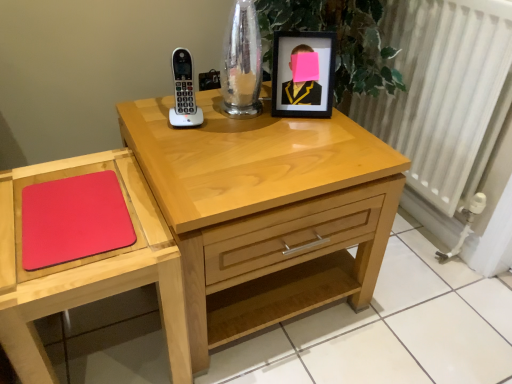
Locate an element on the screen. This screenshot has width=512, height=384. rubberized red mousepad at lower left is located at coordinates [73, 220].

What is the approximate height of rubberized red mousepad at lower left?

rubberized red mousepad at lower left is 2.75 centimeters tall.

Describe the element at coordinates (303, 74) in the screenshot. The width and height of the screenshot is (512, 384). I see `black matte picture frame at upper right` at that location.

You are a GUI agent. You are given a task and a screenshot of the screen. Output one action in this format:
    pyautogui.click(x=<x>, y=<y>)
    Task: Click on the white plastic phone at upper center
    
    Given the screenshot: What is the action you would take?
    pyautogui.click(x=184, y=92)

This screenshot has height=384, width=512. What do you see at coordinates (266, 212) in the screenshot?
I see `light wood nightstand at center` at bounding box center [266, 212].

At what (x,y) coordinates should I click in order to perform the action: click on rubberized red mousepad at lower left. Please return your answer as a coordinate pair (x, y). This screenshot has height=384, width=512. Looking at the image, I should click on (73, 220).

How different are the orientations of white textured radiator at right and white plastic phone at upper center in degrees?

The facing directions of white textured radiator at right and white plastic phone at upper center are 79.3 degrees apart.

From the image's perspective, is white textured radiator at right positioned above or below white plastic phone at upper center?

white textured radiator at right is above white plastic phone at upper center.

Between point (411, 98) and point (184, 115), which one is positioned in front?

Positioned in front is point (184, 115).

This screenshot has width=512, height=384. I want to click on phone on the left of white textured radiator at right, so 184,92.

Is light wood nightstand at center shorter than white plastic phone at upper center?

In fact, light wood nightstand at center may be taller than white plastic phone at upper center.

Is light wood nightstand at center not close to white plastic phone at upper center?

No.

In the scene shown: Is light wood nightstand at center looking in the opposite direction of white plastic phone at upper center?

No.

From the picture: Which is nearer, (395, 159) or (178, 78)?

Point (395, 159) is positioned closer to the camera compared to point (178, 78).

Looking at this image, is rubberized red mousepad at lower left oriented towards light wood nightstand at center?

No, rubberized red mousepad at lower left does not turn towards light wood nightstand at center.

Consider the image. Which of these two, rubberized red mousepad at lower left or light wood nightstand at center, stands shorter?

rubberized red mousepad at lower left.

Is rubberized red mousepad at lower left situated inside light wood nightstand at center or outside?

rubberized red mousepad at lower left is not enclosed by light wood nightstand at center.

From the image's perspective, is rubberized red mousepad at lower left located above light wood nightstand at center?

Yes, from the image's perspective, rubberized red mousepad at lower left is above light wood nightstand at center.

Based on the photo, does black matte picture frame at upper right have a lesser height compared to matte wooden mouse pad at lower left?

Indeed, black matte picture frame at upper right has a lesser height compared to matte wooden mouse pad at lower left.

From the image's perspective, is black matte picture frame at upper right located beneath matte wooden mouse pad at lower left?

No, from the image's perspective, black matte picture frame at upper right is not beneath matte wooden mouse pad at lower left.

Does black matte picture frame at upper right have a lesser width compared to matte wooden mouse pad at lower left?

Yes, black matte picture frame at upper right is thinner than matte wooden mouse pad at lower left.

Could you tell me if black matte picture frame at upper right is facing matte wooden mouse pad at lower left?

No, black matte picture frame at upper right is not turned towards matte wooden mouse pad at lower left.

Is point (326, 58) farther from viewer compared to point (61, 213)?

Yes, point (326, 58) is behind point (61, 213).

Between black matte picture frame at upper right and rubberized red mousepad at lower left, which one has smaller width?

Thinner between the two is black matte picture frame at upper right.

Is black matte picture frame at upper right looking in the opposite direction of rubberized red mousepad at lower left?

black matte picture frame at upper right is not turned away from rubberized red mousepad at lower left.

The height and width of the screenshot is (384, 512). I want to click on notepad to the left of black matte picture frame at upper right, so click(73, 220).

Considering the sizes of light wood nightstand at center and black matte picture frame at upper right in the image, is light wood nightstand at center wider or thinner than black matte picture frame at upper right?

In the image, light wood nightstand at center appears to be wider than black matte picture frame at upper right.

From a real-world perspective, is light wood nightstand at center positioned above or below black matte picture frame at upper right?

In terms of real-world spatial position, light wood nightstand at center is below black matte picture frame at upper right.

Considering the relative sizes of light wood nightstand at center and black matte picture frame at upper right in the image provided, is light wood nightstand at center shorter than black matte picture frame at upper right?

Incorrect, the height of light wood nightstand at center does not fall short of that of black matte picture frame at upper right.

Looking at this image, what's the angular difference between white plastic phone at upper center and light wood nightstand at center's facing directions?

They differ by 11.7 degrees in their facing directions.

Measure the distance from white plastic phone at upper center to light wood nightstand at center.

The distance of white plastic phone at upper center from light wood nightstand at center is 13.41 inches.

Is white plastic phone at upper center looking in the opposite direction of light wood nightstand at center?

No.

At what (x,y) coordinates should I click in order to perform the action: click on nightstand below the white plastic phone at upper center (from a real-world perspective). Please return your answer as a coordinate pair (x, y). The height and width of the screenshot is (384, 512). Looking at the image, I should click on (266, 212).

Locate an element on the screen. phone behind the white textured radiator at right is located at coordinates (184, 92).

The width and height of the screenshot is (512, 384). I want to click on nightstand lying on the right of white plastic phone at upper center, so click(x=266, y=212).

Which object lies further to the anchor point matte wooden mouse pad at lower left, rubberized red mousepad at lower left or light wood nightstand at center?

light wood nightstand at center.

From the image, which object appears to be farther from rubberized red mousepad at lower left, white plastic phone at upper center or light wood nightstand at center?

The object further to rubberized red mousepad at lower left is white plastic phone at upper center.

In the scene shown: When comparing their distances from rubberized red mousepad at lower left, does white plastic phone at upper center or black matte picture frame at upper right seem further?

Among the two, black matte picture frame at upper right is located further to rubberized red mousepad at lower left.

Which object lies nearer to the anchor point matte wooden mouse pad at lower left, rubberized red mousepad at lower left or white plastic phone at upper center?

rubberized red mousepad at lower left is positioned closer to the anchor matte wooden mouse pad at lower left.

Estimate the real-world distances between objects in this image. Which object is closer to white plastic phone at upper center, black matte picture frame at upper right or matte wooden mouse pad at lower left?

The object closer to white plastic phone at upper center is black matte picture frame at upper right.

Based on their spatial positions, is white textured radiator at right or black matte picture frame at upper right further from white plastic phone at upper center?

Based on the image, white textured radiator at right appears to be further to white plastic phone at upper center.

Looking at the image, which one is located closer to white textured radiator at right, white plastic phone at upper center or matte wooden mouse pad at lower left?

Among the two, white plastic phone at upper center is located nearer to white textured radiator at right.

From the picture: Which object lies further to the anchor point white textured radiator at right, black matte picture frame at upper right or rubberized red mousepad at lower left?

Based on the image, rubberized red mousepad at lower left appears to be further to white textured radiator at right.

At what (x,y) coordinates should I click in order to perform the action: click on nightstand between black matte picture frame at upper right and matte wooden mouse pad at lower left from top to bottom. Please return your answer as a coordinate pair (x, y). The height and width of the screenshot is (384, 512). Looking at the image, I should click on (266, 212).

Find the location of a particular element. The height and width of the screenshot is (384, 512). phone situated between matte wooden mouse pad at lower left and white textured radiator at right from left to right is located at coordinates (184, 92).

The image size is (512, 384). In order to click on notepad situated between matte wooden mouse pad at lower left and light wood nightstand at center from left to right in this screenshot , I will do `click(73, 220)`.

Locate an element on the screen. The image size is (512, 384). picture frame between matte wooden mouse pad at lower left and white textured radiator at right is located at coordinates (303, 74).